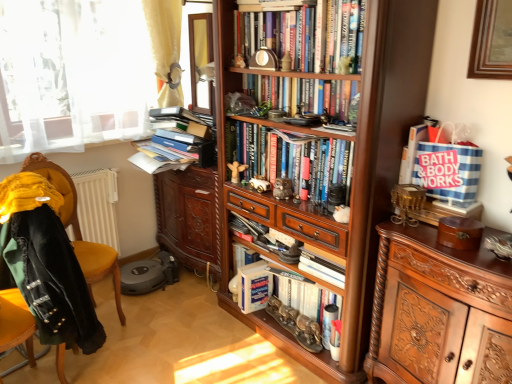
In order to click on vacant region below velvet yellow chair at left (from a real-world perspective) in this screenshot , I will do `click(80, 367)`.